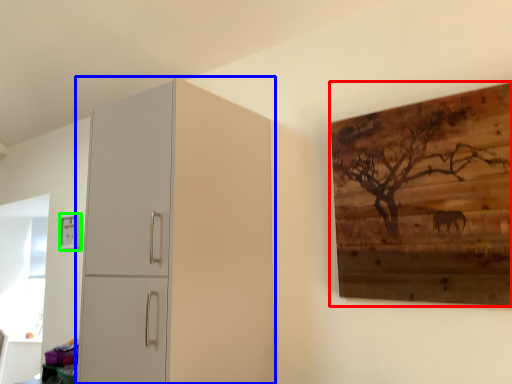
Question: Which is farther away from picture frame (highlighted by a red box)? cupboard (highlighted by a blue box) or picture frame (highlighted by a green box)?

Choices:
 (A) cupboard
 (B) picture frame

Answer: (B)